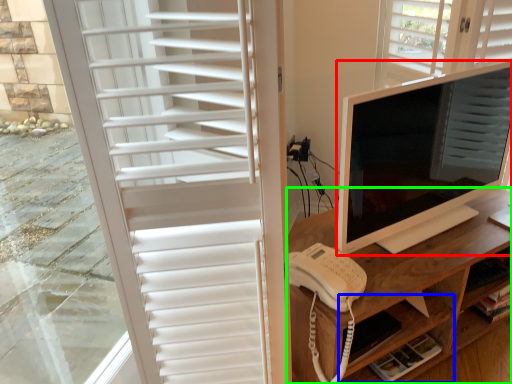
Question: Considering the real-world distances, which object is farthest from computer monitor (highlighted by a red box)? shelf (highlighted by a blue box) or desk (highlighted by a green box)?

Choices:
 (A) shelf
 (B) desk

Answer: (A)